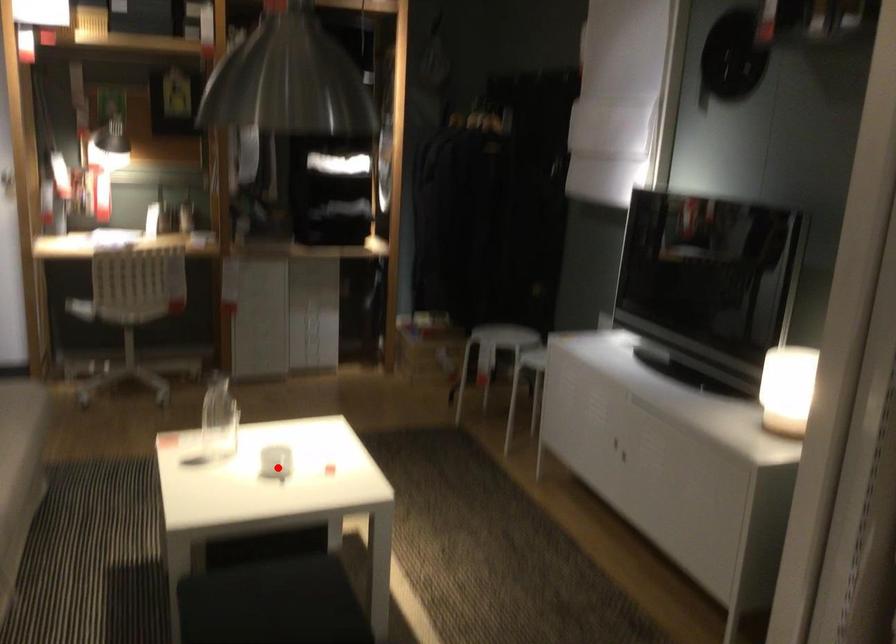
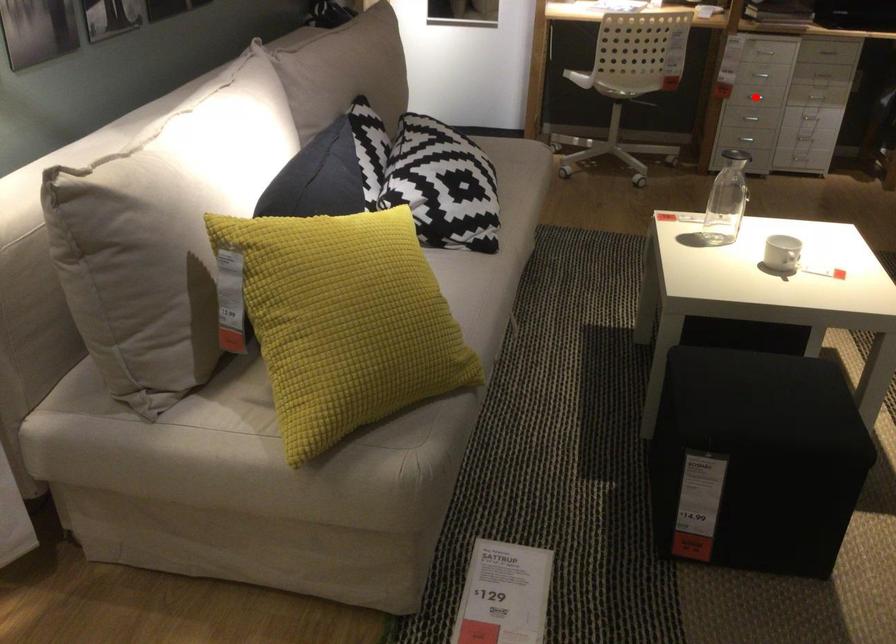
I am providing you with two images of the same scene from different viewpoints. A red point is marked on the first image and another point is marked on the second image. Does the point marked in image1 correspond to the same location as the one in image2?

No